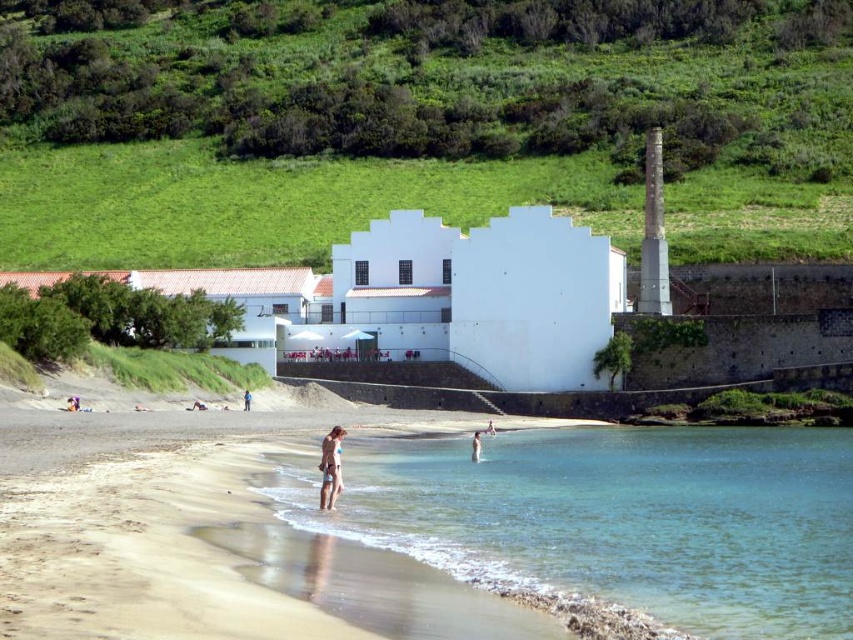
In the scene shown: Who is higher up, beige fabric bikini at center or smooth skin person at lower center?

beige fabric bikini at center

Does beige fabric bikini at center have a lesser height compared to smooth skin person at lower center?

No.

Which is in front, point (335, 486) or point (492, 426)?

Positioned in front is point (335, 486).

You are a GUI agent. You are given a task and a screenshot of the screen. Output one action in this format:
    pyautogui.click(x=<x>, y=<y>)
    Task: Click on the beige fabric bikini at center
    
    Given the screenshot: What is the action you would take?
    pyautogui.click(x=329, y=467)

Measure the distance between point (459, 580) and camera.

177.77 feet

Looking at this image, is the position of clear water at beach center less distant than that of beige fabric bikini at center?

Yes, it is in front of beige fabric bikini at center.

This screenshot has height=640, width=853. What do you see at coordinates (625, 520) in the screenshot? I see `clear water at beach center` at bounding box center [625, 520].

Image resolution: width=853 pixels, height=640 pixels. Identify the location of clear water at beach center. (625, 520).

What do you see at coordinates (424, 125) in the screenshot? I see `green grass at upper center` at bounding box center [424, 125].

You are a GUI agent. You are given a task and a screenshot of the screen. Output one action in this format:
    pyautogui.click(x=<x>, y=<y>)
    Task: Click on the green grass at upper center
    
    Given the screenshot: What is the action you would take?
    pyautogui.click(x=424, y=125)